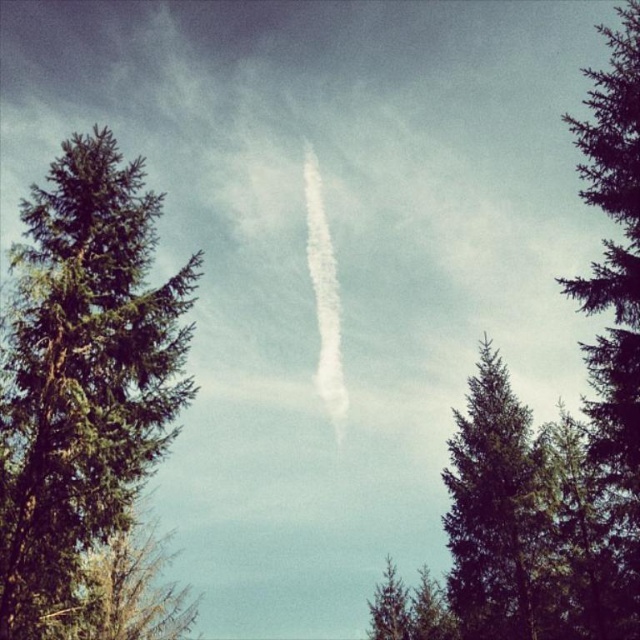
You are a nature photographer setting up a tripod in the forest. You want to capture both the green textured tree at left and the green textured pine tree at center in your shot. Which tree should you focus on to ensure both are fully visible in the frame?

You should focus on the green textured pine tree at center because it occupies more space than the green textured tree at left, ensuring both can be captured in the frame.

You are a bird flying over the forest. You see the green textured tree at left and the green textured pine tree at center. Which tree is closer to the ground?

The green textured tree at left is closer to the ground because it is positioned below the green textured pine tree at center.